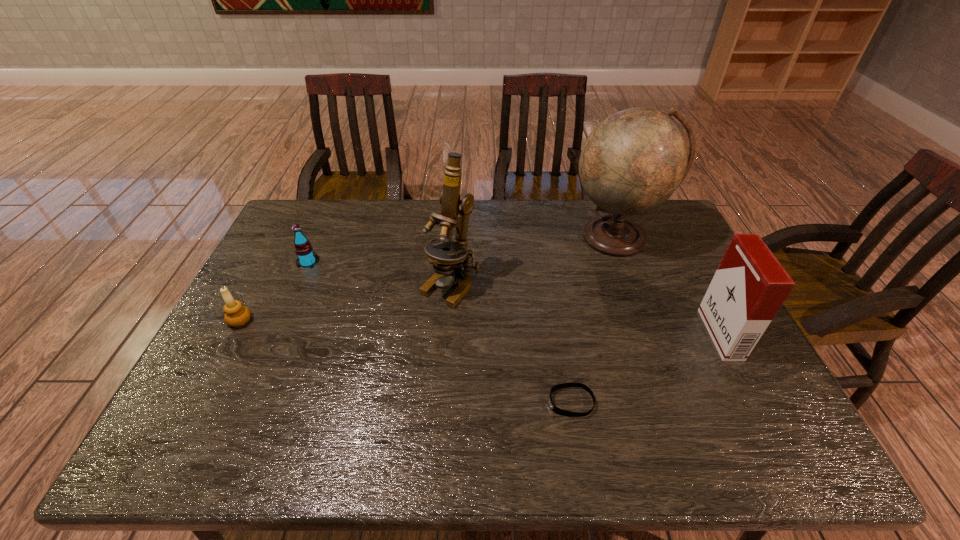
Image resolution: width=960 pixels, height=540 pixels. Find the location of `vacant position located on the front-facing side of the fourth shortest object`. vacant position located on the front-facing side of the fourth shortest object is located at coordinates 647,334.

You are a GUI agent. You are given a task and a screenshot of the screen. Output one action in this format:
    pyautogui.click(x=<x>, y=<y>)
    Task: Click on the vacant space positioned on the front-facing side of the fourth shortest object
    The height and width of the screenshot is (540, 960).
    Given the screenshot: What is the action you would take?
    pyautogui.click(x=647, y=334)

Where is `free location located 0.200m on the back of the soda`? This screenshot has height=540, width=960. free location located 0.200m on the back of the soda is located at coordinates (326, 220).

In order to click on vacant space located on the back of the candle_holder in this screenshot , I will do `click(276, 253)`.

Locate an element on the screen. The width and height of the screenshot is (960, 540). blank area located 0.210m on the display of the nearest object is located at coordinates (459, 402).

Image resolution: width=960 pixels, height=540 pixels. Find the location of `free space located 0.120m on the display of the nearest object`. free space located 0.120m on the display of the nearest object is located at coordinates (497, 402).

Locate an element on the screen. Image resolution: width=960 pixels, height=540 pixels. vacant space located on the display of the nearest object is located at coordinates (446, 402).

Find the location of a particular element. The height and width of the screenshot is (540, 960). object that is at the far edge is located at coordinates (633, 161).

Where is `soda that is at the left edge`? soda that is at the left edge is located at coordinates (306, 258).

Where is `candle_holder that is at the left edge`? The height and width of the screenshot is (540, 960). candle_holder that is at the left edge is located at coordinates (236, 314).